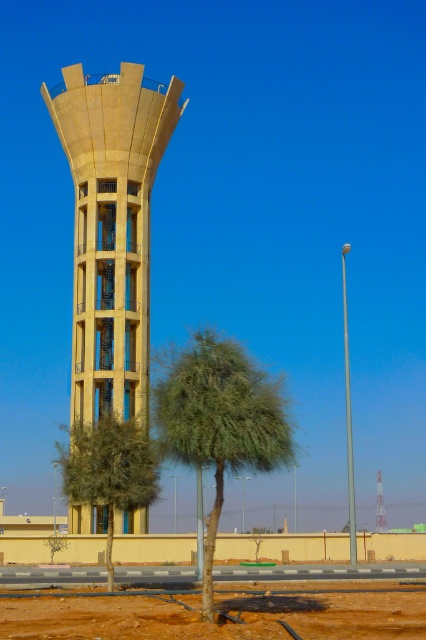
Question: Which point is closer to the camera?

Choices:
 (A) (91, 468)
 (B) (146, 259)

Answer: (A)

Question: Considering the relative positions of beige concrete tower at center and green leafy tree at lower center in the image provided, where is beige concrete tower at center located with respect to green leafy tree at lower center?

Choices:
 (A) above
 (B) below

Answer: (A)

Question: Does beige concrete tower at center appear on the right side of green leafy tree at lower center?

Choices:
 (A) no
 (B) yes

Answer: (A)

Question: Does green leafy tree at center have a greater width compared to green leafy tree at lower center?

Choices:
 (A) no
 (B) yes

Answer: (A)

Question: Considering the real-world distances, which object is farthest from the green leafy tree at center?

Choices:
 (A) beige concrete tower at center
 (B) green leafy tree at lower center

Answer: (A)

Question: Which point is farther from the camera taking this photo?

Choices:
 (A) (207, 422)
 (B) (91, 458)
 (C) (77, 531)

Answer: (C)